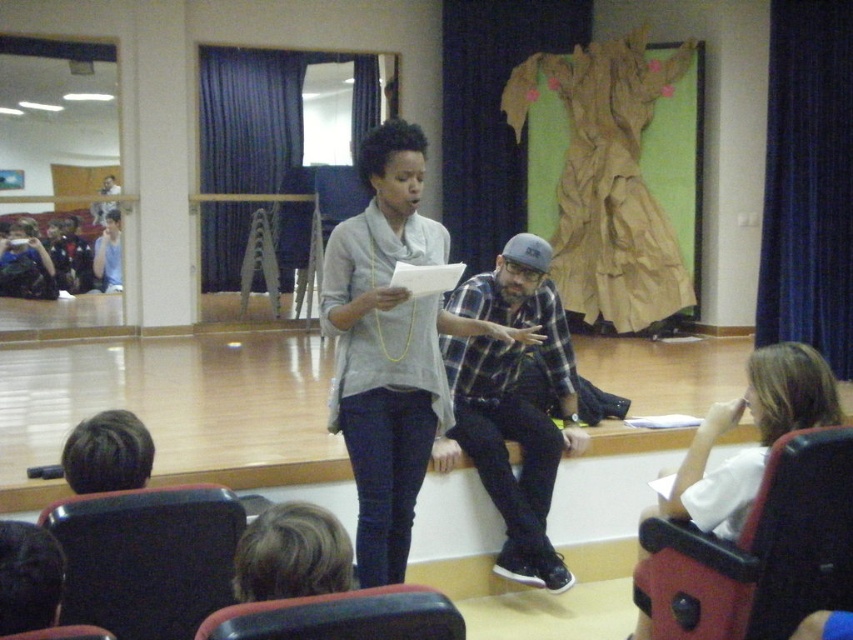
You are an event planner setting up chairs for a small discussion panel. You have two chairs to place on the stage. The black leather chair at lower right needs to be positioned so that it is exactly 4 feet away from the matte black chair at lower left. Based on the current setup shown in the image, will the chairs need to be moved closer together or farther apart to meet this requirement?

The black leather chair at lower right is currently 4.25 feet away from the matte black chair at lower left. To achieve the desired 4 feet distance, the chairs need to be moved closer together by 0.25 feet.

You are an event organizer setting up chairs for a small discussion panel in the auditorium. You have two chairs available, the matte black chair at lower left and the black leather chair at lower right. The stage has limited space, and you need to place them so that one is in front of the other. Based on the current arrangement, which chair is positioned further back and should be moved forward to create space?

The matte black chair at lower left is behind the black leather chair at lower right, so to create space, the matte black chair at lower left should be moved forward.